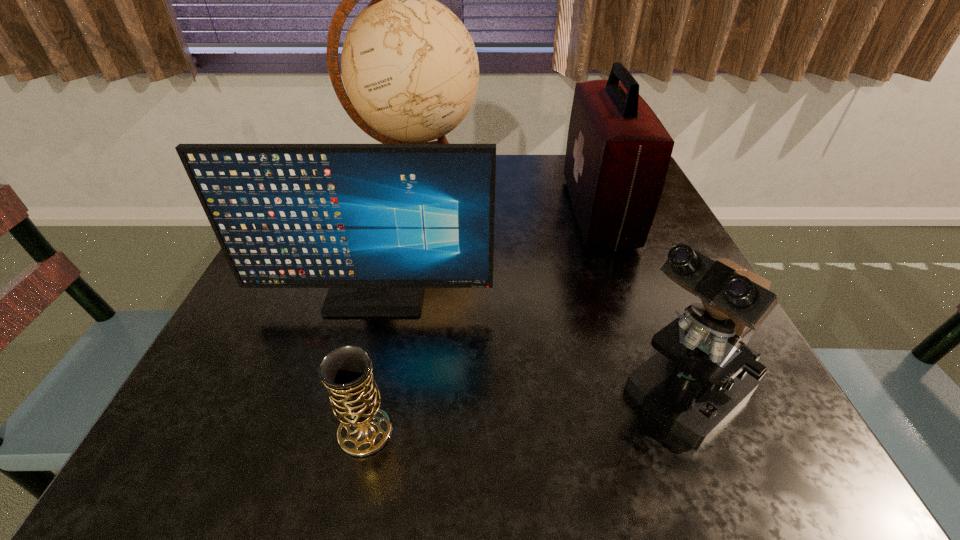
This screenshot has height=540, width=960. I want to click on object located in the far left corner section of the desktop, so click(x=410, y=68).

Where is `object at the far right corner`? object at the far right corner is located at coordinates (618, 152).

Where is `object present at the near right corner`? object present at the near right corner is located at coordinates (704, 370).

This screenshot has height=540, width=960. I want to click on vacant space at the far edge of the desktop, so click(509, 193).

Image resolution: width=960 pixels, height=540 pixels. In the image, there is a desktop. Find the location of `vacant space at the near edge`. vacant space at the near edge is located at coordinates (420, 424).

The image size is (960, 540). In the image, there is a desktop. Find the location of `free space at the left edge`. free space at the left edge is located at coordinates (274, 362).

In the image, there is a desktop. At what (x,y) coordinates should I click in order to perform the action: click on free space at the right edge. Please return your answer as a coordinate pair (x, y). The height and width of the screenshot is (540, 960). Looking at the image, I should click on (648, 263).

Find the location of a particular element. This screenshot has height=540, width=960. empty space between the shortest object and the first aid kit is located at coordinates (482, 322).

Locate an element on the screen. empty location between the tallest object and the microscope is located at coordinates (548, 293).

This screenshot has height=540, width=960. In order to click on free space between the first aid kit and the microscope in this screenshot , I will do `click(639, 303)`.